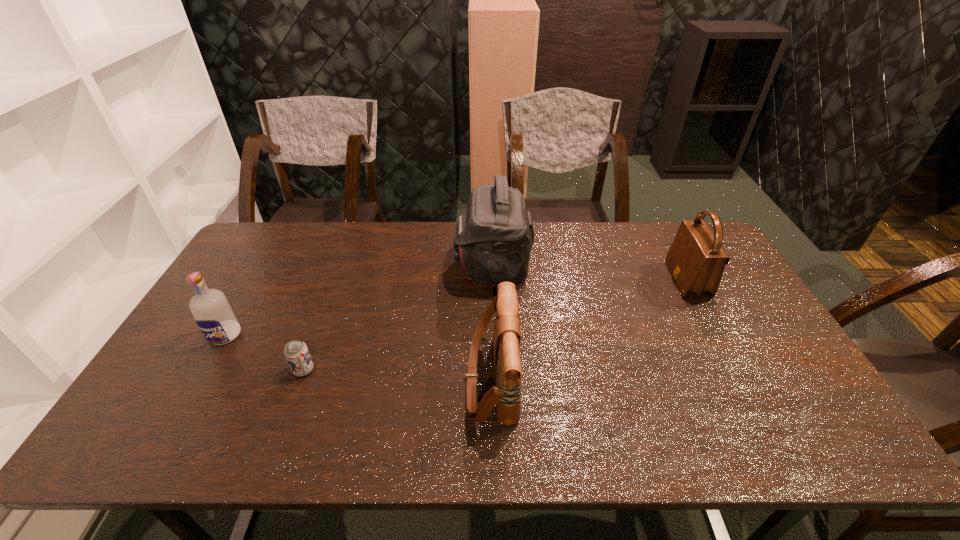
I want to click on vacant space located 0.320m on the front flap of the rightmost shoulder bag, so click(572, 280).

Find the location of a particular element. vacant space situated 0.090m on the front flap of the rightmost shoulder bag is located at coordinates (644, 280).

What are the coordinates of `vacant area located 0.080m on the label of the leftmost object` in the screenshot? It's located at (204, 372).

I want to click on vacant space located on the front-facing side of the nearest shoulder bag, so click(x=379, y=379).

This screenshot has height=540, width=960. In order to click on vacant region located 0.300m on the front-facing side of the nearest shoulder bag in this screenshot , I will do `click(348, 379)`.

Locate an element on the screen. The image size is (960, 540). blank space located on the front-facing side of the nearest shoulder bag is located at coordinates (379, 379).

Locate an element on the screen. free space located 0.320m on the right of the beer can is located at coordinates (437, 370).

This screenshot has height=540, width=960. Identify the location of object situated at the near edge. (506, 395).

Identify the location of object that is positioned at the left edge. (213, 314).

At what (x,y) coordinates should I click in order to perform the action: click on object that is positioned at the right edge. Please return your answer as a coordinate pair (x, y). Looking at the image, I should click on (x=696, y=260).